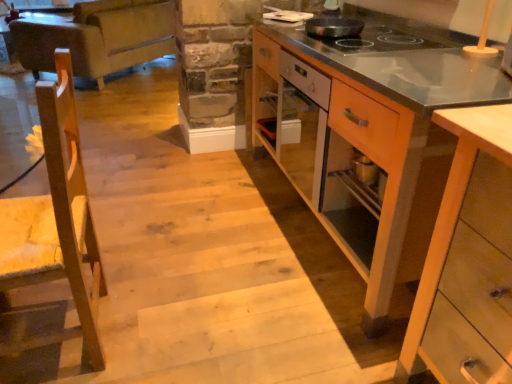
Question: Is point (505, 258) positioned closer to the camera than point (354, 29)?

Choices:
 (A) closer
 (B) farther

Answer: (A)

Question: Based on their sizes in the image, would you say light wood cabinet at lower right, which ranks as the second cabinetry in back-to-front order, is bigger or smaller than black non-stick pan at upper center?

Choices:
 (A) small
 (B) big

Answer: (B)

Question: Based on their relative distances, which object is farther from the wooden cabinet at right, the first cabinetry viewed from the back?

Choices:
 (A) black non-stick pan at upper center
 (B) leather couch at upper left
 (C) light wood cabinet at lower right, the 1th cabinetry in the front-to-back sequence
 (D) wooden chair at left

Answer: (B)

Question: Considering the real-world distances, which object is farthest from the light wood cabinet at lower right, which ranks as the second cabinetry in back-to-front order?

Choices:
 (A) wooden chair at left
 (B) wooden cabinet at right, the first cabinetry viewed from the back
 (C) leather couch at upper left
 (D) black non-stick pan at upper center

Answer: (C)